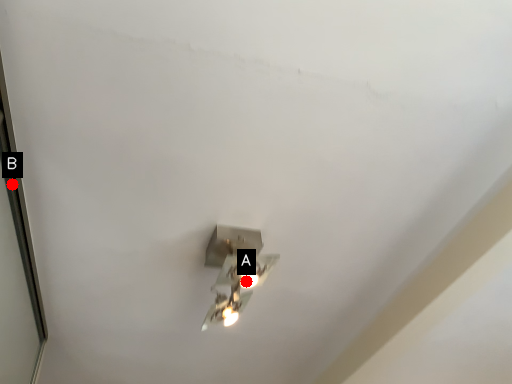
Question: Two points are circled on the image, labeled by A and B beside each circle. Which point is farther to the camera?

Choices:
 (A) A is further
 (B) B is further

Answer: (A)